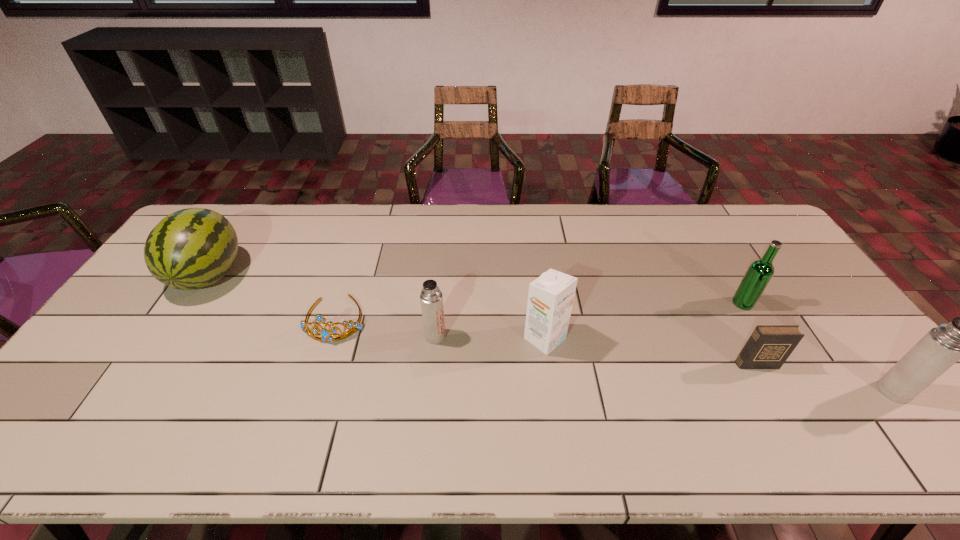
Where is `the left thermos bottle`? The height and width of the screenshot is (540, 960). the left thermos bottle is located at coordinates (x=431, y=298).

Identify the location of the fifth object from right to left. (431, 298).

You are a GUI agent. You are given a task and a screenshot of the screen. Output one action in this format:
    pyautogui.click(x=<x>, y=<y>)
    Task: Click on the nearer thermos bottle
    
    Given the screenshot: What is the action you would take?
    pyautogui.click(x=942, y=346)

The height and width of the screenshot is (540, 960). Identify the location of the rightmost object. (942, 346).

Where is `the leftmost object`? The height and width of the screenshot is (540, 960). the leftmost object is located at coordinates (193, 248).

Locate an element on the screen. The height and width of the screenshot is (540, 960). beer bottle is located at coordinates (760, 272).

What are the coordinates of `diary` in the screenshot? It's located at (769, 346).

This screenshot has width=960, height=540. What are the coordinates of `the sixth farthest object` in the screenshot? It's located at (769, 346).

This screenshot has height=540, width=960. Find the location of `the fourth object from right to left`. the fourth object from right to left is located at coordinates (550, 298).

The image size is (960, 540). Find the location of `the shortest object`. the shortest object is located at coordinates (326, 334).